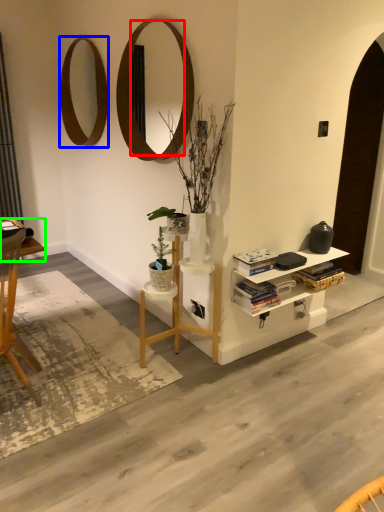
Question: Considering the real-world distances, which object is farthest from mirror (highlighted by a red box)? mirror (highlighted by a blue box) or desk (highlighted by a green box)?

Choices:
 (A) mirror
 (B) desk

Answer: (B)